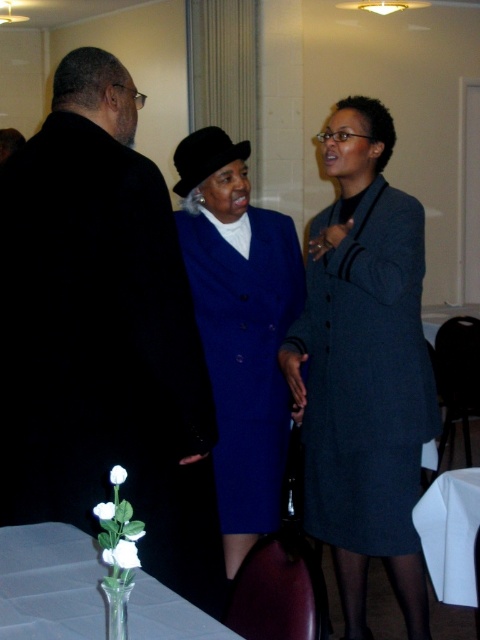
Can you confirm if black matte coat at left is taller than clear glass vase at lower left?

Correct, black matte coat at left is much taller as clear glass vase at lower left.

Between black matte coat at left and clear glass vase at lower left, which one is positioned higher?

black matte coat at left

Who is more distant from viewer, [216,531] or [62,632]?

The point [216,531] is behind.

The width and height of the screenshot is (480, 640). In order to click on black matte coat at left in this screenshot , I will do `click(103, 336)`.

Is clear glass vase at lower left behind white paper napkin at lower right?

That is False.

Does clear glass vase at lower left have a larger size compared to white paper napkin at lower right?

Actually, clear glass vase at lower left might be smaller than white paper napkin at lower right.

At what (x,y) coordinates should I click in order to perform the action: click on clear glass vase at lower left. Please return your answer as a coordinate pair (x, y). This screenshot has width=480, height=640. Looking at the image, I should click on pyautogui.click(x=49, y=582).

This screenshot has width=480, height=640. Find the location of `clear glass vase at lower left`. clear glass vase at lower left is located at coordinates (49, 582).

Is point (253, 435) less distant than point (160, 600)?

No, it is not.

Can you confirm if royal blue woolen coat at center is smaller than clear glass vase at lower left?

Incorrect, royal blue woolen coat at center is not smaller in size than clear glass vase at lower left.

The width and height of the screenshot is (480, 640). Identify the location of royal blue woolen coat at center. (245, 355).